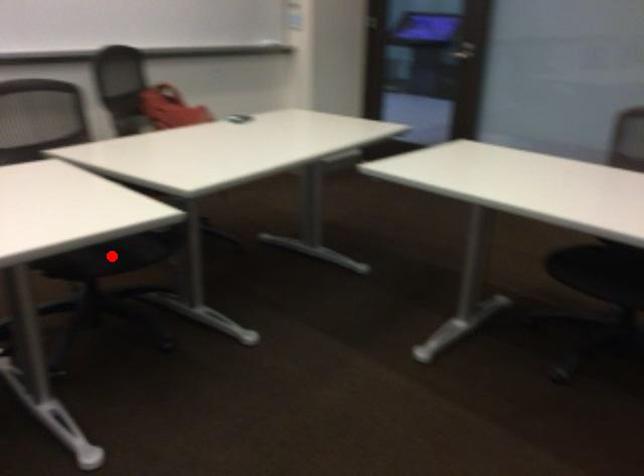
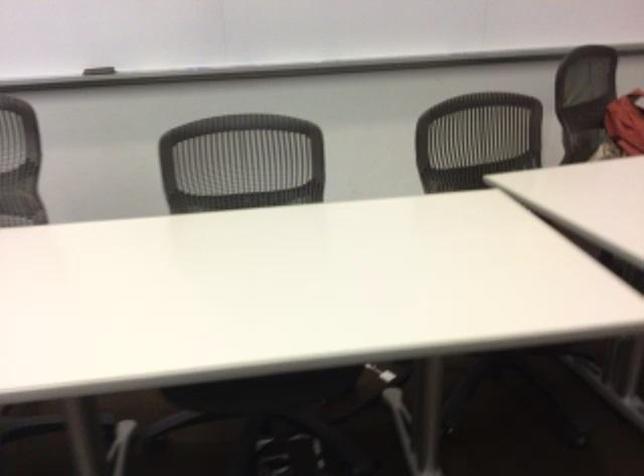
Question: I am providing you with two images of the same scene from different viewpoints. A red point is marked on the first image. Is the red point's position out of view in image 2?

Choices:
 (A) Yes
 (B) No

Answer: (A)